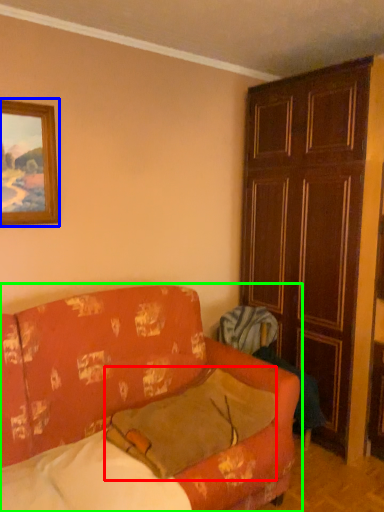
Question: Considering the real-world distances, which object is farthest from pillow (highlighted by a red box)? picture frame (highlighted by a blue box) or studio couch (highlighted by a green box)?

Choices:
 (A) picture frame
 (B) studio couch

Answer: (A)